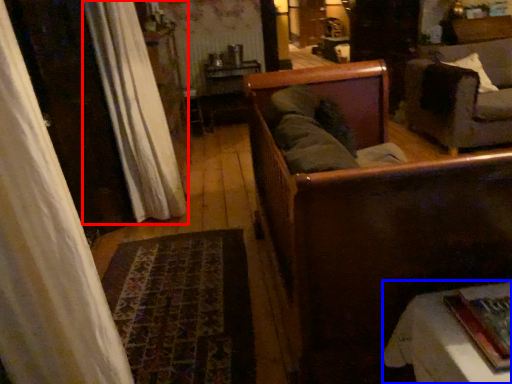
Question: Which object appears farthest to the camera in this image, curtain (highlighted by a red box) or furniture (highlighted by a blue box)?

Choices:
 (A) curtain
 (B) furniture

Answer: (A)